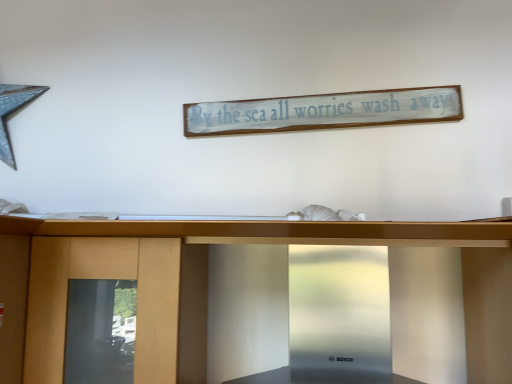
Question: In which direction should I rotate to look at white distressed wood signboard at upper center?

Choices:
 (A) right
 (B) left

Answer: (A)

Question: From a real-world perspective, does stainless steel range hood at center stand above white distressed wood signboard at upper center?

Choices:
 (A) no
 (B) yes

Answer: (A)

Question: Is stainless steel range hood at center facing towards white distressed wood signboard at upper center?

Choices:
 (A) no
 (B) yes

Answer: (A)

Question: Is stainless steel range hood at center positioned with its back to white distressed wood signboard at upper center?

Choices:
 (A) no
 (B) yes

Answer: (A)

Question: Can white distressed wood signboard at upper center be found inside stainless steel range hood at center?

Choices:
 (A) yes
 (B) no

Answer: (B)

Question: Can you confirm if stainless steel range hood at center is taller than white distressed wood signboard at upper center?

Choices:
 (A) yes
 (B) no

Answer: (A)

Question: Is stainless steel range hood at center wider than white distressed wood signboard at upper center?

Choices:
 (A) yes
 (B) no

Answer: (A)

Question: Is white distressed wood signboard at upper center positioned behind stainless steel range hood at center?

Choices:
 (A) yes
 (B) no

Answer: (A)

Question: Is white distressed wood signboard at upper center taller than stainless steel range hood at center?

Choices:
 (A) no
 (B) yes

Answer: (A)

Question: Does white distressed wood signboard at upper center appear on the left side of stainless steel range hood at center?

Choices:
 (A) no
 (B) yes

Answer: (A)

Question: Is there a large distance between white distressed wood signboard at upper center and stainless steel range hood at center?

Choices:
 (A) yes
 (B) no

Answer: (B)

Question: From the image's perspective, is white distressed wood signboard at upper center located above stainless steel range hood at center?

Choices:
 (A) no
 (B) yes

Answer: (B)

Question: Is white distressed wood signboard at upper center in contact with stainless steel range hood at center?

Choices:
 (A) yes
 (B) no

Answer: (B)

Question: In the image, is white distressed wood signboard at upper center positioned in front of or behind stainless steel range hood at center?

Choices:
 (A) front
 (B) behind

Answer: (B)